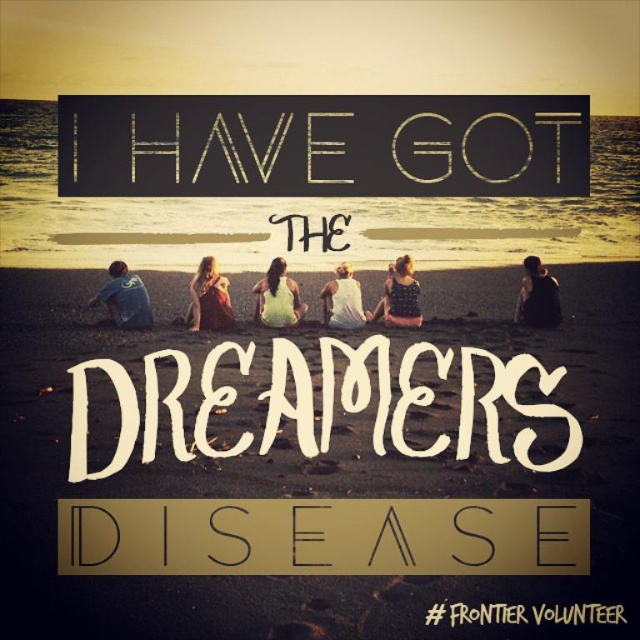
You are a photographer trying to capture a candid shot of the two people at the center of the beach scene. The person wearing the patterned fabric dress at center is sitting closer to the camera than the white cotton shirt at center. Would the dress be visible in the photo if the shirt is blocking the view?

The patterned fabric dress at center is shorter than the white cotton shirt at center. Since the dress is shorter, it might still be partially visible depending on the angle and the height difference between the two individuals.

You are a photographer trying to capture a candid shot of the group. You want to ensure that both the blue denim shirt at lower left and the black matte tank top at center are clearly visible in the frame. Which direction should you position yourself relative to the group to ensure both are visible?

To ensure both the blue denim shirt at lower left and the black matte tank top at center are visible, position yourself to the right side of the group. This way, you can see the blue denim shirt at lower left on the left and the black matte tank top at center in the middle of the frame.

You are a photographer planning to take a group photo of the patterned fabric dress at center and the white cotton shirt at center. Which one should you focus on if you want to capture the larger subject in the scene?

The patterned fabric dress at center has a larger size compared to the white cotton shirt at center, so you should focus on the patterned fabric dress at center to capture the larger subject.